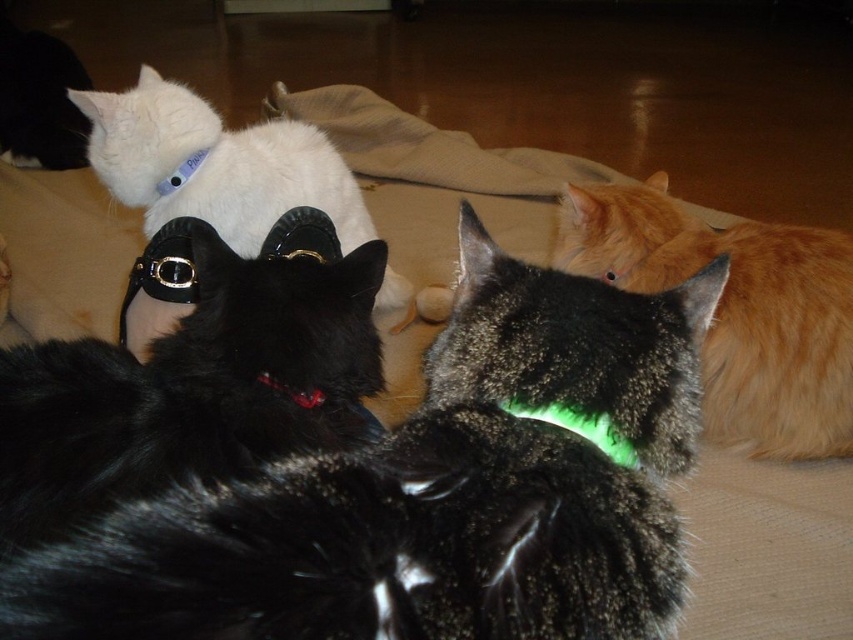
Between black glossy shoe at upper left and shiny red plastic collar at center, which one appears on the left side from the viewer's perspective?

From the viewer's perspective, black glossy shoe at upper left appears more on the left side.

Is black glossy shoe at upper left below shiny red plastic collar at center?

Incorrect, black glossy shoe at upper left is not positioned below shiny red plastic collar at center.

I want to click on black glossy shoe at upper left, so click(x=189, y=388).

Who is positioned more to the left, black glossy shoe at upper left or green fluorescent plastic at center?

black glossy shoe at upper left is more to the left.

Is point (378, 352) positioned behind point (578, 429)?

Yes.

Locate an element on the screen. The height and width of the screenshot is (640, 853). black glossy shoe at upper left is located at coordinates (189, 388).

The height and width of the screenshot is (640, 853). In order to click on black glossy shoe at upper left in this screenshot , I will do `click(189, 388)`.

Is shiny black cat at center above green fluorescent plastic at center?

Yes.

Does point (466, 595) lie in front of point (515, 406)?

Yes, it is in front of point (515, 406).

Measure the distance between shiny black cat at center and camera.

shiny black cat at center and camera are 36.54 centimeters apart from each other.

Locate an element on the screen. shiny black cat at center is located at coordinates (431, 493).